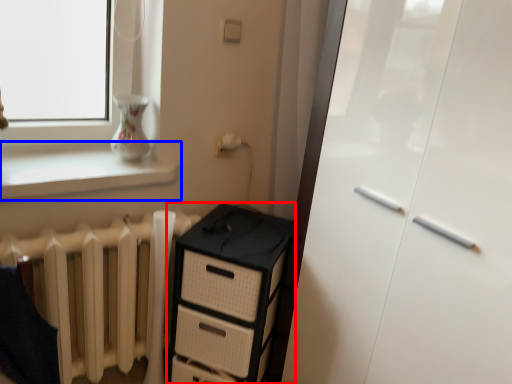
Question: Which point is closer to the camera, chest of drawers (highlighted by a red box) or window sill (highlighted by a blue box)?

Choices:
 (A) chest of drawers
 (B) window sill

Answer: (B)